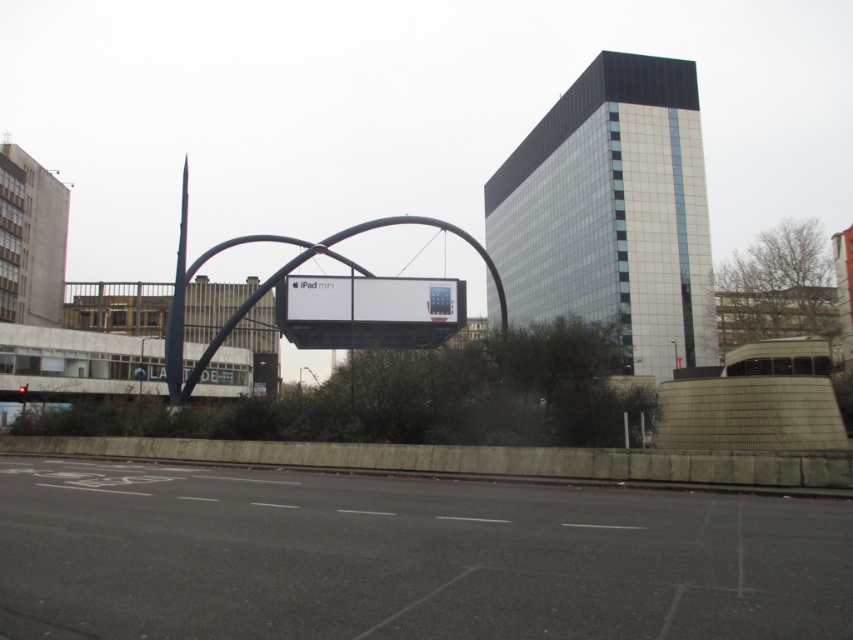
You are a delivery drone that needs to fly through the space between the white glossy ipad mini at center and the metallic archway at center. Can you safely pass through this space if your drone has a height of 1 meter?

The white glossy ipad mini at center is positioned under the metallic archway at center. Since the drone has a height of 1 meter, it can safely pass through the space as long as the vertical clearance between the two objects is at least 1 meter. However, the exact height isnecessary to confirm this.

You are a photographer standing in front of the white glossy ipad mini at center and the metallic archway at center. You want to take a photo that includes both objects but focuses on the ipad mini. Which object should you position closer to the camera to achieve this?

To focus on the white glossy ipad mini at center, position the white glossy ipad mini at center closer to the camera than the metallic archway at center, as it is already further away from the viewer compared to the metallic archway at center.

You are a photographer planning to take a picture of the white glossy ipad mini at center and the metallic archway at center. Which object should you focus on first if you want to capture both in a single frame without moving the camera?

The white glossy ipad mini at center is smaller than the metallic archway at center, so you should focus on the metallic archway at center first to ensure it is in sharp focus while the smaller ipad mini will also be in focus due to its proximity in the frame.